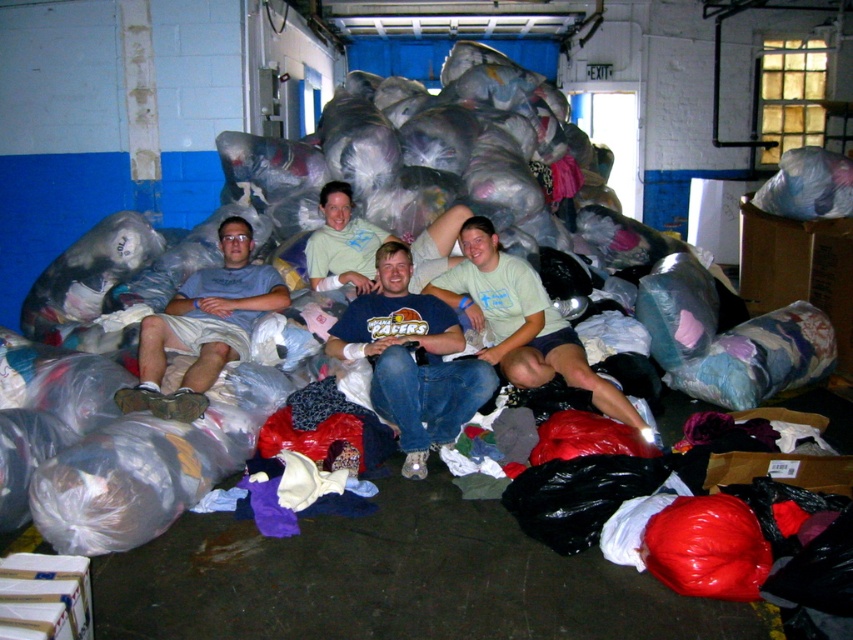
Question: Does matte green t-shirt at center have a lesser width compared to light green t-shirt at center?

Choices:
 (A) no
 (B) yes

Answer: (A)

Question: Estimate the real-world distances between objects in this image. Which object is closer to the matte gray t-shirt at center?

Choices:
 (A) light green t-shirt at center
 (B) blue cotton t-shirt at center
 (C) matte green t-shirt at center

Answer: (A)

Question: Which point is closer to the camera?

Choices:
 (A) matte gray t-shirt at center
 (B) light green t-shirt at center

Answer: (A)

Question: Is blue cotton t-shirt at center further to the viewer compared to matte gray t-shirt at center?

Choices:
 (A) no
 (B) yes

Answer: (B)

Question: Considering the relative positions of matte gray t-shirt at center and matte green t-shirt at center in the image provided, where is matte gray t-shirt at center located with respect to matte green t-shirt at center?

Choices:
 (A) right
 (B) left

Answer: (B)

Question: Which of the following is the closest to the observer?

Choices:
 (A) matte gray t-shirt at center
 (B) light green t-shirt at center
 (C) blue cotton t-shirt at center

Answer: (A)